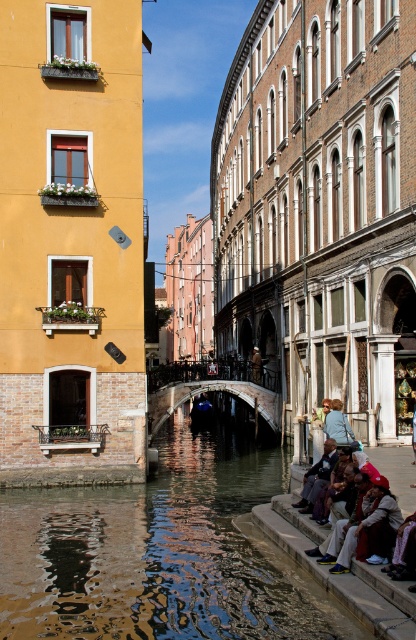
Between smooth stone ledge at lower right and light blue fabric jacket at lower right, which one appears on the right side from the viewer's perspective?

light blue fabric jacket at lower right is more to the right.

Is smooth stone ledge at lower right above light blue fabric jacket at lower right?

No, smooth stone ledge at lower right is not above light blue fabric jacket at lower right.

Where is `smooth stone ledge at lower right`? This screenshot has width=416, height=640. smooth stone ledge at lower right is located at coordinates (341, 573).

Image resolution: width=416 pixels, height=640 pixels. I want to click on smooth stone ledge at lower right, so (341, 573).